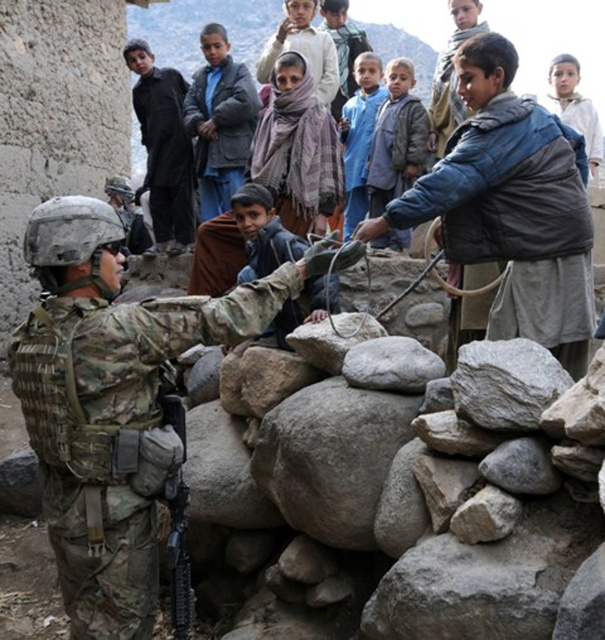
Is blue fuzzy vest at center bigger than blue fabric shirt at center?

Incorrect, blue fuzzy vest at center is not larger than blue fabric shirt at center.

Does blue fuzzy vest at center have a lesser height compared to blue fabric shirt at center?

Yes, blue fuzzy vest at center is shorter than blue fabric shirt at center.

Identify the location of blue fuzzy vest at center. (511, 205).

I want to click on blue fuzzy vest at center, so [511, 205].

Can you confirm if black woolen jacket at upper center is shorter than blue fabric shirt at center?

Correct, black woolen jacket at upper center is not as tall as blue fabric shirt at center.

Is point (177, 77) closer to viewer compared to point (374, 116)?

Yes, it is.

What are the coordinates of `black woolen jacket at upper center` in the screenshot? It's located at (163, 147).

Who is shorter, blue woolen sweater at center or blue fabric shirt at center?

With less height is blue woolen sweater at center.

Is point (401, 131) positioned behind point (367, 52)?

That is False.

Who is more forward, (388,180) or (370,61)?

Positioned in front is point (388,180).

Identify the location of blue woolen sweater at center. (396, 138).